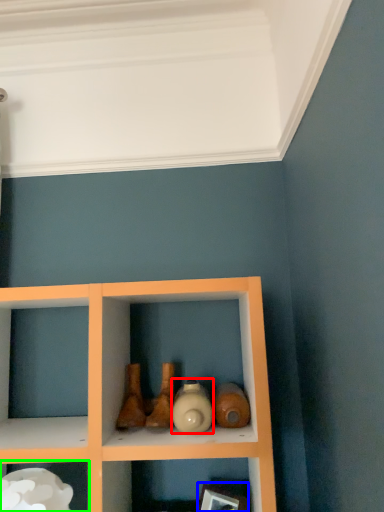
Question: Which is farther away from bottle (highlighted by a red box)? picture frame (highlighted by a blue box) or shelf (highlighted by a green box)?

Choices:
 (A) picture frame
 (B) shelf

Answer: (B)